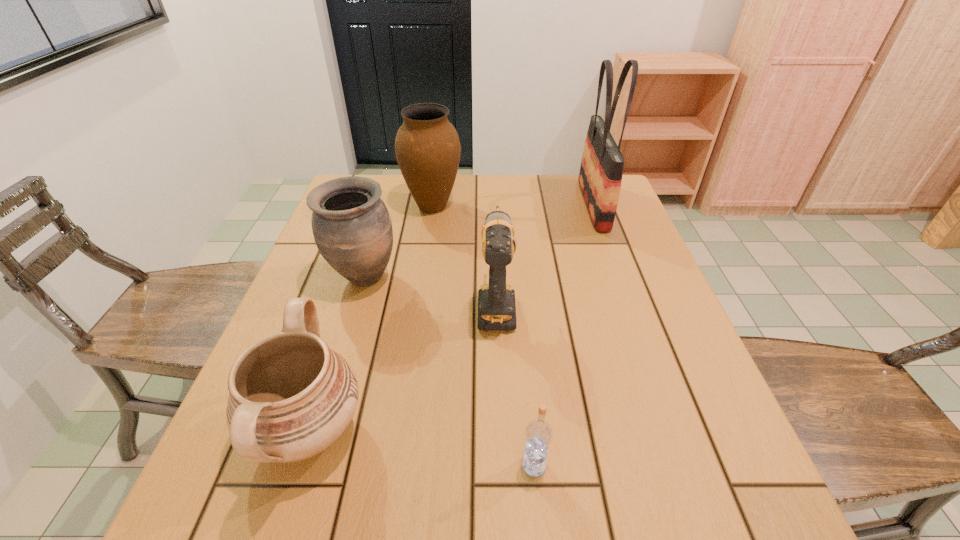
Where is `blank space located 0.070m on the front-facing side of the rightmost object`? This screenshot has height=540, width=960. blank space located 0.070m on the front-facing side of the rightmost object is located at coordinates (557, 205).

Locate an element on the screen. free space located on the right of the tallest urn is located at coordinates (544, 206).

Where is `free spot located 0.090m on the front of the second nearest urn`? The height and width of the screenshot is (540, 960). free spot located 0.090m on the front of the second nearest urn is located at coordinates coord(348,332).

Identify the location of free location located with the drill bit of the drill facing forward. (492, 206).

I want to click on vacant space located 0.270m with the drill bit of the drill facing forward, so point(492,217).

The height and width of the screenshot is (540, 960). In order to click on free space located 0.180m with the drill bit of the drill facing forward in this screenshot , I will do `click(493, 234)`.

Locate an element on the screen. Image resolution: width=960 pixels, height=540 pixels. free spot located on the front-facing side of the nearest urn is located at coordinates (400, 431).

I want to click on blank space located 0.240m on the back of the shortest object, so click(x=522, y=345).

This screenshot has height=540, width=960. I want to click on shopping bag that is at the far edge, so click(601, 170).

This screenshot has height=540, width=960. I want to click on urn positioned at the far edge, so click(x=427, y=147).